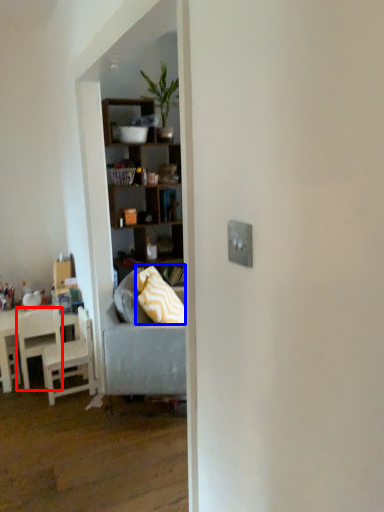
Question: Which point is closer to the camera, chair (highlighted by a red box) or pillow (highlighted by a blue box)?

Choices:
 (A) chair
 (B) pillow

Answer: (B)